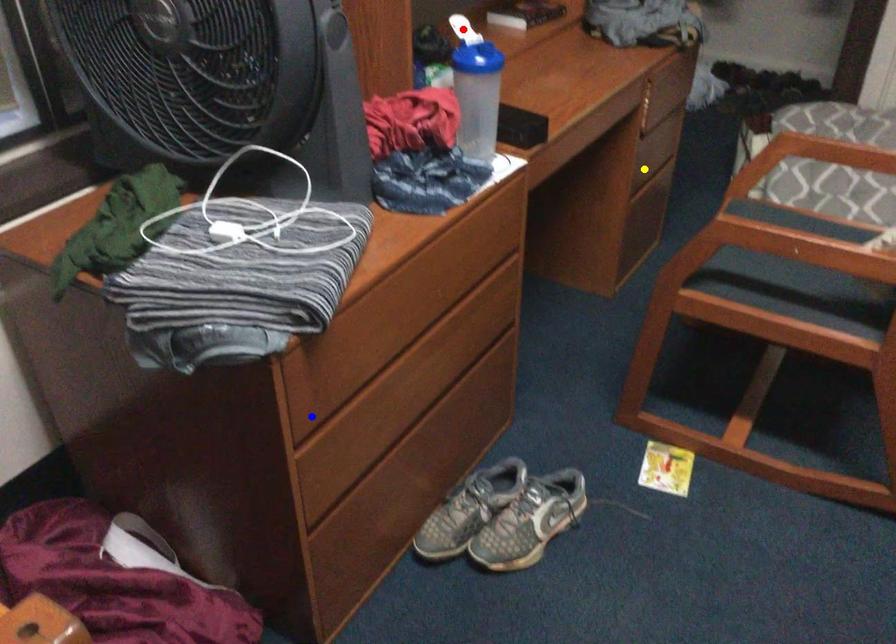
Order these from farthest to nearest:
1. blue point
2. yellow point
3. red point

1. yellow point
2. red point
3. blue point